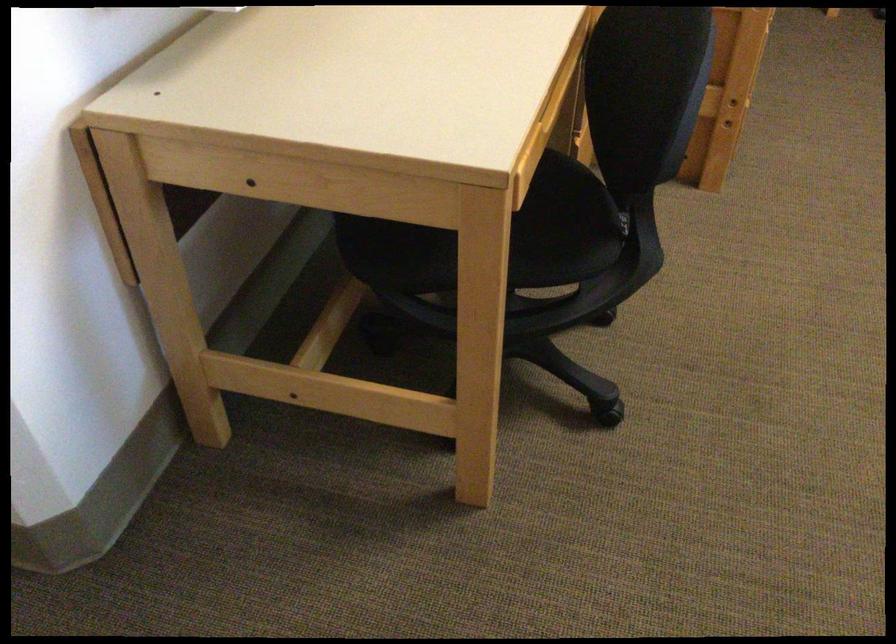
This screenshot has width=896, height=644. Find the location of `chair sitting surface`. chair sitting surface is located at coordinates (554, 214).